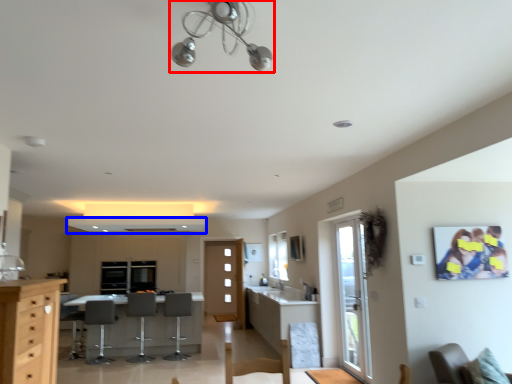
Question: Among these objects, which one is nearest to the camera, light fixture (highlighted by a red box) or exhaust hood (highlighted by a blue box)?

Choices:
 (A) light fixture
 (B) exhaust hood

Answer: (A)